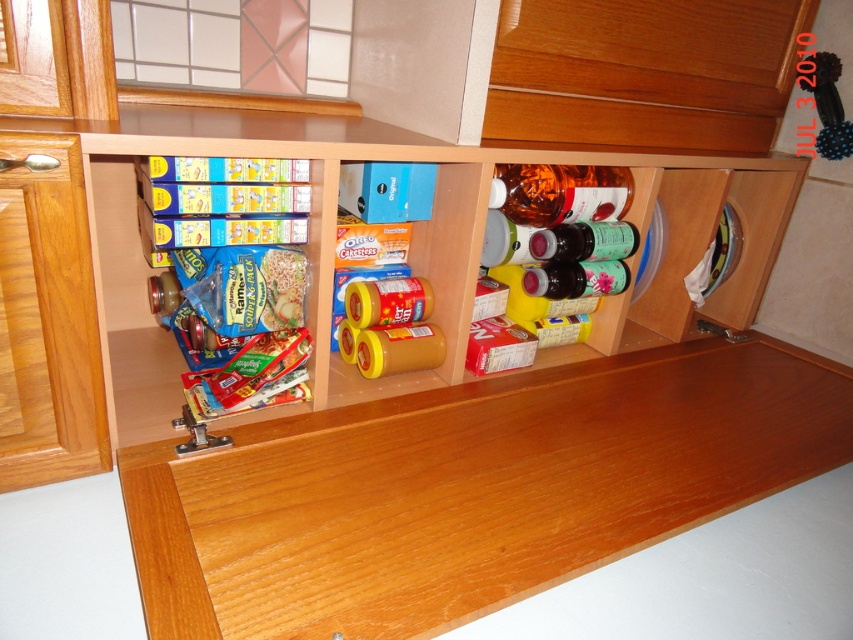
Between point (483, 451) and point (622, 339), which one is positioned behind?

Point (622, 339)

Which is behind, point (218, 572) or point (213, 426)?

Positioned behind is point (213, 426).

I want to click on wooden at center, so click(469, 490).

The height and width of the screenshot is (640, 853). What do you see at coordinates (469, 490) in the screenshot?
I see `wooden at center` at bounding box center [469, 490].

Who is positioned more to the right, wooden at center or metallic hinge at lower left?

wooden at center is more to the right.

Identify the location of wooden at center. The height and width of the screenshot is (640, 853). (469, 490).

Who is positioned more to the right, wooden cabinet at center or metallic hinge at lower left?

From the viewer's perspective, wooden cabinet at center appears more on the right side.

Does wooden cabinet at center have a lesser height compared to metallic hinge at lower left?

No.

Which is behind, point (236, 145) or point (201, 435)?

The point (201, 435) is more distant.

Where is `wooden cabinet at center`? wooden cabinet at center is located at coordinates (479, 237).